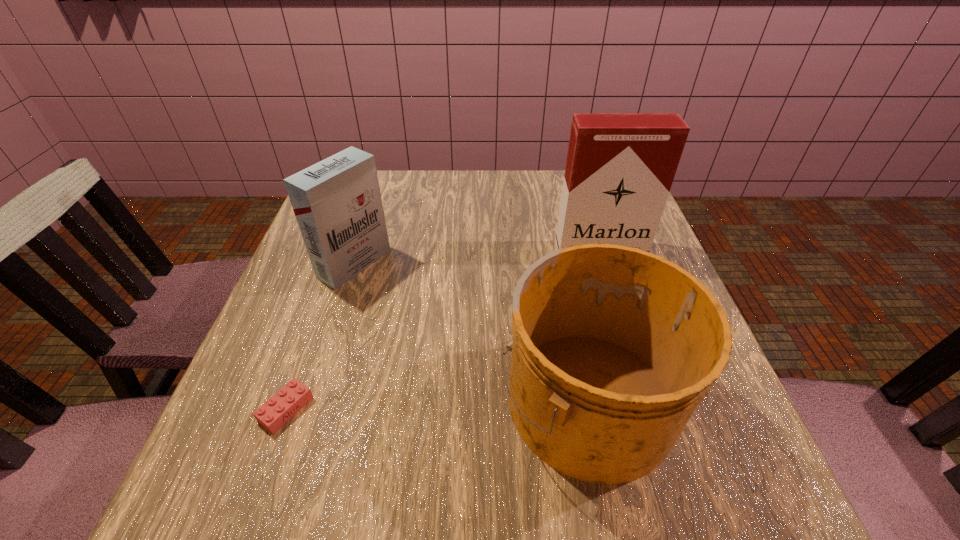
Identify the location of vacant space in between the bucket and the shortest object. pyautogui.click(x=437, y=403).

At what (x,y) coordinates should I click in order to perform the action: click on vacant area between the right cigarette case and the shorter cigarette case. Please return your answer as a coordinate pair (x, y). Image resolution: width=960 pixels, height=540 pixels. Looking at the image, I should click on (477, 257).

Find the location of `vacant space that's between the shortest object and the shorter cigarette case`. vacant space that's between the shortest object and the shorter cigarette case is located at coordinates coord(321,336).

This screenshot has width=960, height=540. Identify the location of vacant region between the bucket and the shorter cigarette case. (471, 331).

This screenshot has width=960, height=540. Identify the location of vacant area that lies between the bucket and the Lego. (437, 403).

In order to click on vacant space that is in between the taller cigarette case and the Lego in this screenshot , I will do `click(444, 329)`.

You are a GUI agent. You are given a task and a screenshot of the screen. Output one action in this format:
    pyautogui.click(x=<x>, y=<y>)
    Task: Click on the vacant space that's between the shorter cigarette case and the bucket
    This screenshot has width=960, height=540.
    Given the screenshot: What is the action you would take?
    pyautogui.click(x=471, y=331)

Identify the location of free space between the bucket and the left cigarette case. This screenshot has width=960, height=540. click(x=471, y=331).

Locate which object is the second closest to the left cigarette case. Please provide its 2D coordinates. Your answer should be formatted as a tuple, i.e. [(x, y)], where the tuple contains the x and y coordinates of a point satisfying the conditions above.

[(613, 348)]

Locate an element on the screen. the third closest object relative to the bucket is located at coordinates (276, 411).